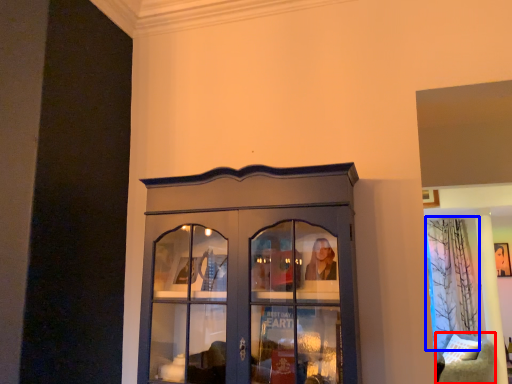
Question: Which point is further to the camera, furniture (highlighted by a red box) or curtain (highlighted by a blue box)?

Choices:
 (A) furniture
 (B) curtain

Answer: (B)